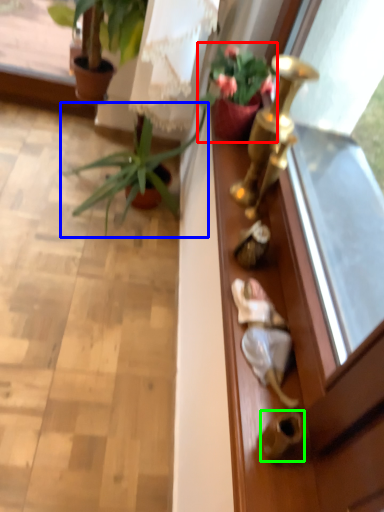
Question: Which object is the farthest from houseplant (highlighted by a red box)? Choose among these: houseplant (highlighted by a blue box) or door handle (highlighted by a green box).

Choices:
 (A) houseplant
 (B) door handle

Answer: (B)